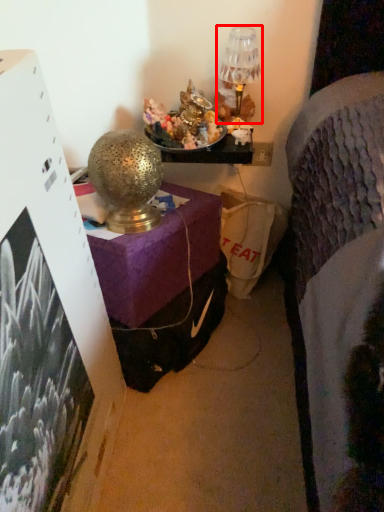
Question: From the image's perspective, what is the correct spatial positioning of table lamp (annotated by the red box) in reference to table lamp?

Choices:
 (A) below
 (B) above

Answer: (B)